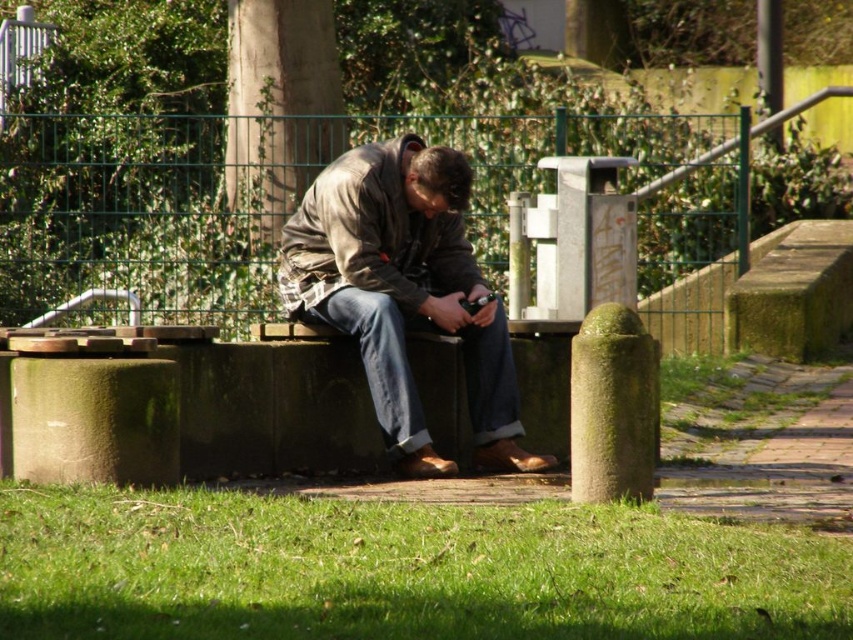
Question: Can you confirm if denim jacket at center is smaller than brown textured jacket at center?

Choices:
 (A) no
 (B) yes

Answer: (A)

Question: Which of the following is the closest to the observer?

Choices:
 (A) (415, 234)
 (B) (428, 268)

Answer: (A)

Question: Which of the following is the closest to the observer?

Choices:
 (A) (399, 192)
 (B) (402, 284)

Answer: (B)

Question: Among these objects, which one is nearest to the camera?

Choices:
 (A) brown textured jacket at center
 (B) denim jacket at center

Answer: (B)

Question: Is denim jacket at center to the right of brown textured jacket at center from the viewer's perspective?

Choices:
 (A) no
 (B) yes

Answer: (B)

Question: Is denim jacket at center wider than brown textured jacket at center?

Choices:
 (A) yes
 (B) no

Answer: (A)